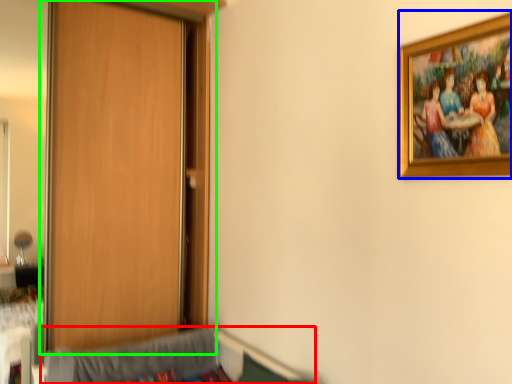
Question: Considering the real-world distances, which object is farthest from hospital bed (highlighted by a red box)? picture frame (highlighted by a blue box) or door (highlighted by a green box)?

Choices:
 (A) picture frame
 (B) door

Answer: (A)